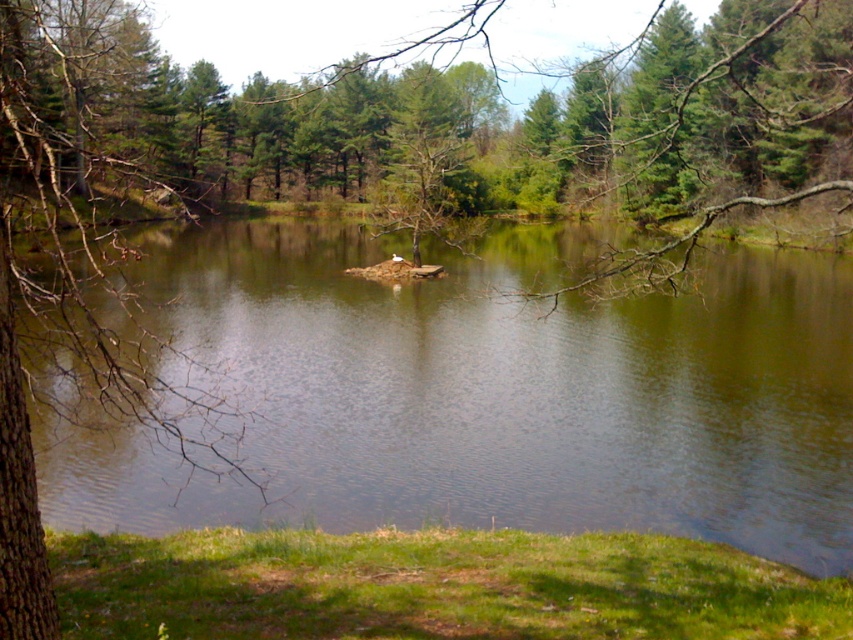
What is located at the coordinates point [490,394] in the image?

The point [490,394] corresponds to green reflective water at center.

You are standing at the edge of the pond and want to take a photo of the green reflective water at center. If your camera can focus up to 20 feet away, will you be able to capture a clear image?

The green reflective water at center is 17.50 feet away from the viewer, which is within the camera focus range of 20 feet. Therefore, you can capture a clear image.

You are standing on the grassy area in the foreground and want to observe both the green reflective water at center and the brown bark tree at left. Which object is closer to your current position?

The green reflective water at center is closer to your current position because it is located below the brown bark tree at left, meaning it is situated between you and the tree.